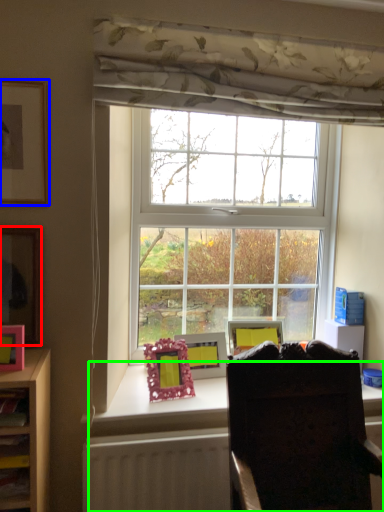
Question: Which object is positioned farthest from picture frame (highlighted by a red box)? Select from picture frame (highlighted by a blue box) and desk (highlighted by a green box).

Choices:
 (A) picture frame
 (B) desk

Answer: (B)